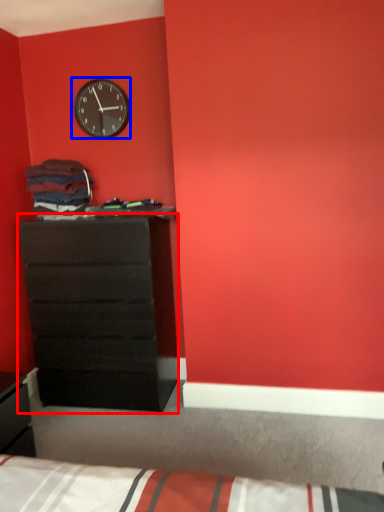
Question: Which of the following is the closest to the observer, chest of drawers (highlighted by a red box) or wall clock (highlighted by a blue box)?

Choices:
 (A) chest of drawers
 (B) wall clock

Answer: (A)